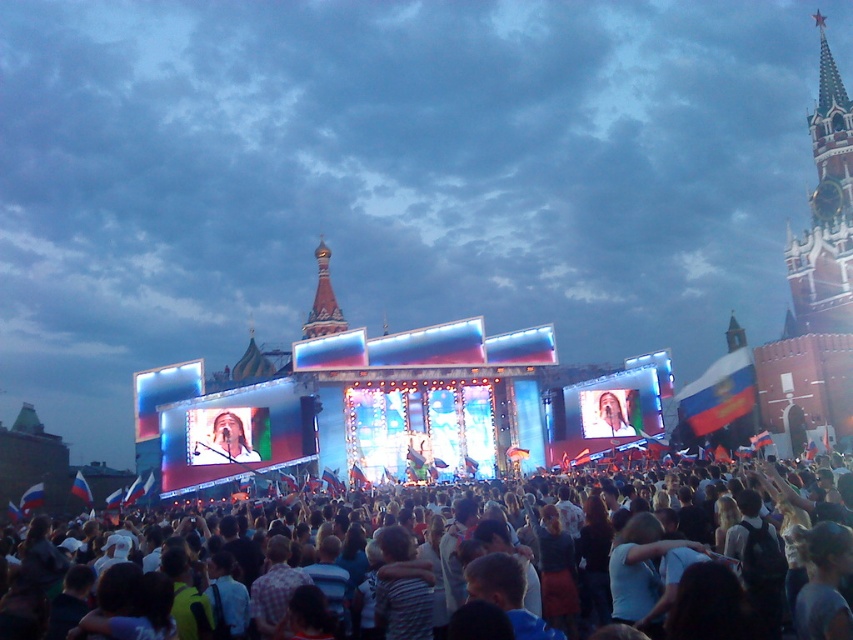
Does matte screen at center have a larger size compared to matte white face at center?

Indeed, matte screen at center has a larger size compared to matte white face at center.

Is point (283, 451) positioned before point (604, 396)?

Yes, it is in front of point (604, 396).

At what (x,y) coordinates should I click in order to perform the action: click on matte screen at center. Please return your answer as a coordinate pair (x, y). Image resolution: width=853 pixels, height=640 pixels. Looking at the image, I should click on (235, 435).

Where is `matte screen at center`? matte screen at center is located at coordinates (235, 435).

Who is positioned more to the right, matte black crowd at center or matte white face at center?

From the viewer's perspective, matte white face at center appears more on the right side.

Can you confirm if matte black crowd at center is taller than matte white face at center?

Indeed, matte black crowd at center has a greater height compared to matte white face at center.

Does point (299, 524) come in front of point (611, 404)?

Yes, it is.

In order to click on matte black crowd at center in this screenshot , I will do `click(236, 580)`.

Does matte screen at center appear under shiny gold dome at center?

Yes.

Locate an element on the screen. The image size is (853, 640). matte screen at center is located at coordinates (235, 435).

Image resolution: width=853 pixels, height=640 pixels. I want to click on matte screen at center, so click(x=235, y=435).